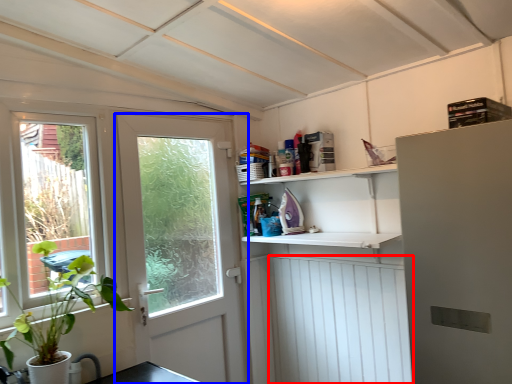
Question: Which object appears farthest to the camera in this image, screen door (highlighted by a red box) or door (highlighted by a blue box)?

Choices:
 (A) screen door
 (B) door

Answer: (A)